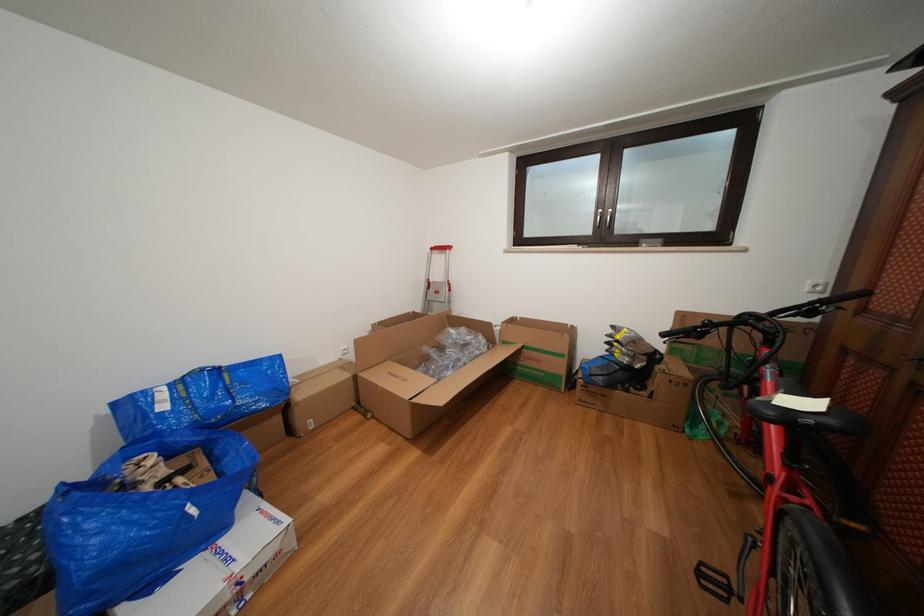
Where would you push the bicycle bell? Please return your answer as a coordinate pair (x, y).

(708, 331)